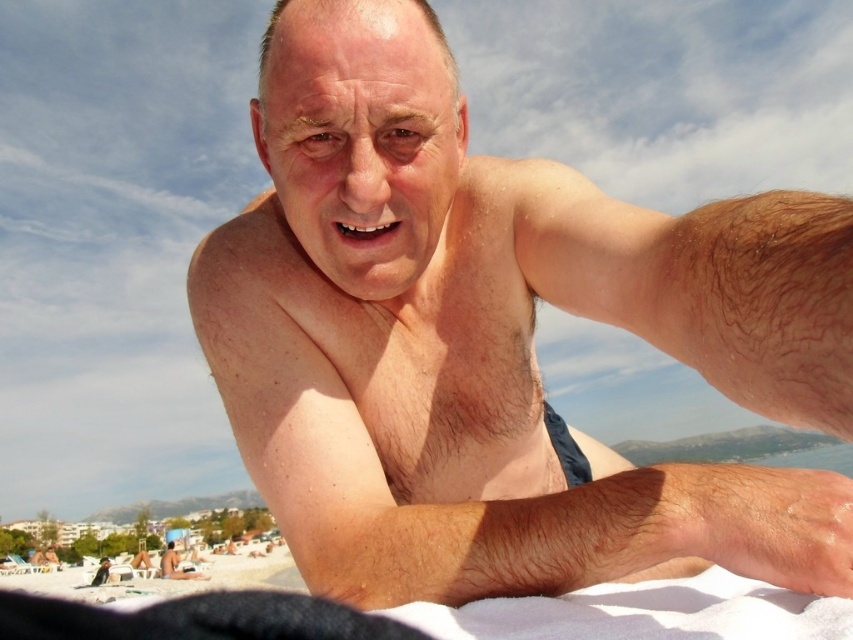
In the scene shown: You are a photographer trying to capture the scene of the smooth skin man at center and the white sand at lower left. From the photographer perspective, which object is located to the right side?

The smooth skin man at center is positioned on the right side of white sand at lower left, so the smooth skin man at center is located to the right side.

You are a photographer trying to capture a closeup shot of the man taking a selfie on the beach. You notice two points of interest in the scene marked as point 1 at coordinates point (450, 60) and point 2 at coordinates point (167, 561). Which point should you focus on to ensure the subject is in sharp focus?

Point 1 at coordinates point (450, 60) is closer to the camera than point 2 at coordinates point (167, 561), so focusing on point 1 will keep the subject in sharp focus.

You are a photographer trying to capture the man taking a selfie on the beach. Based on the scene, where should you position yourself to ensure the man at point (x=498, y=340) is centered in your shot?

To center the man at point (x=498, y=340) in your shot, position yourself directly in front of him, aligning your camera with his location on the beach.